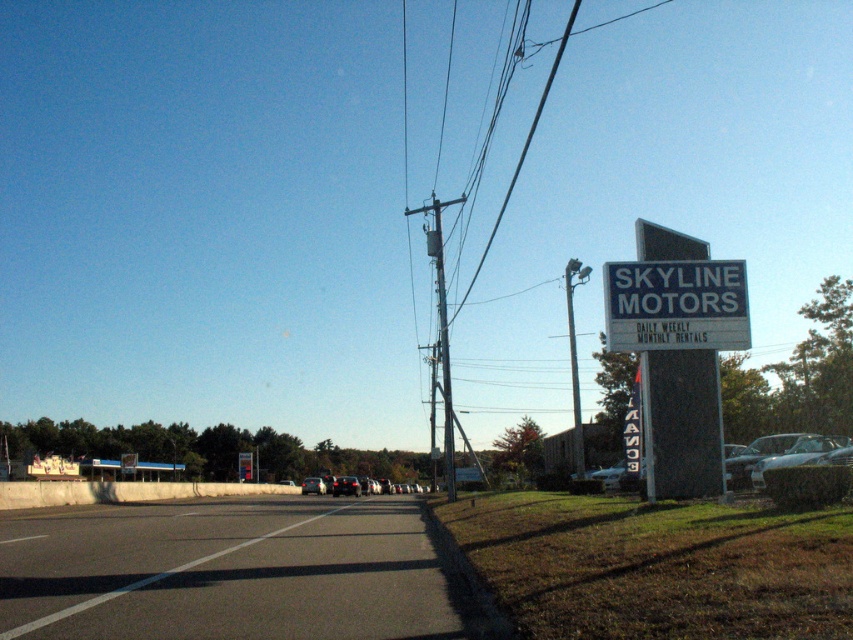
You are a parking attendant and need to park both the shiny silver sedan at center and the matte black car at center in a parking spot that is 2 meters wide. Which car do you think will fit better in the spot?

The shiny silver sedan at center is thinner than the matte black car at center, so it will fit better in the 2 meter wide parking spot.

You are a pedestrian standing on the sidewalk looking towards the Skyline Motors sign. You see the white plastic sign at upper right and the metallic gray pole at upper right. Which object is closer to the road?

The white plastic sign at upper right is positioned under the metallic gray pole at upper right, meaning the sign is closer to the road than the pole.

You are standing at the roadside scene and want to locate the point with coordinates (676, 305). According to the image, where exactly is this point located?

The point (676, 305) is located on the white plastic sign at upper right.